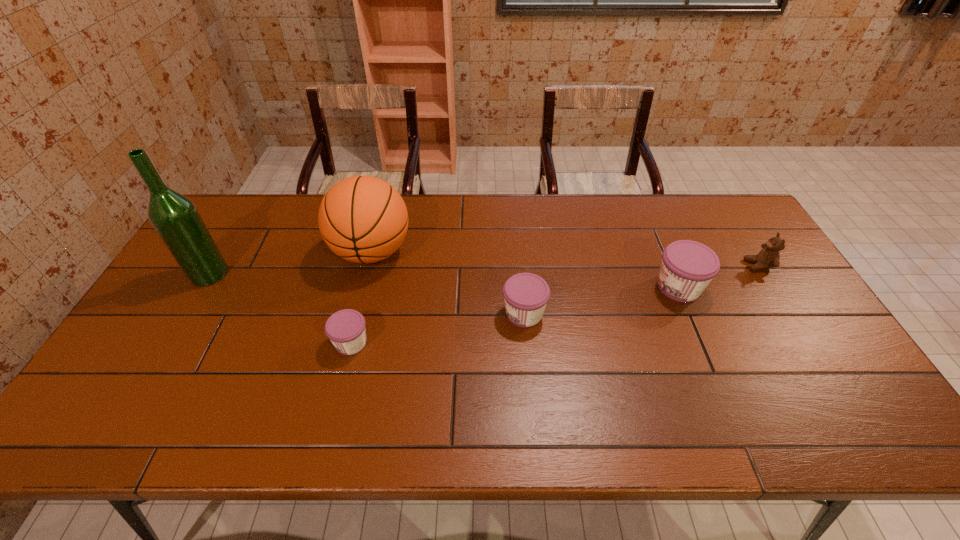
The width and height of the screenshot is (960, 540). I want to click on vacant space in between the second tallest object and the fifth object from left to right, so click(x=525, y=269).

This screenshot has width=960, height=540. In order to click on empty location between the leftmost jam and the teddy bear in this screenshot , I will do `click(555, 304)`.

Locate an element on the screen. The image size is (960, 540). vacant point located between the leftmost object and the rightmost object is located at coordinates (484, 269).

Where is `blank region between the teddy bear and the leftmost object`? The width and height of the screenshot is (960, 540). blank region between the teddy bear and the leftmost object is located at coordinates (484, 269).

Identify which object is located as the second nearest to the teddy bear. Please provide its 2D coordinates. Your answer should be formatted as a tuple, i.e. [(x, y)], where the tuple contains the x and y coordinates of a point satisfying the conditions above.

[(525, 294)]

Find the location of a particular element. The height and width of the screenshot is (540, 960). the closest object to the leftmost object is located at coordinates click(363, 219).

Locate which jam is the closest to the basketball. Please provide its 2D coordinates. Your answer should be formatted as a tuple, i.e. [(x, y)], where the tuple contains the x and y coordinates of a point satisfying the conditions above.

[(346, 330)]

The image size is (960, 540). What are the coordinates of `the closest jam to the leftmost object` in the screenshot? It's located at (346, 330).

Where is `vacant space that satisfies the following two spatial constraints: 1. at the face of the teddy bear; 2. on the front side of the tallest object`? The width and height of the screenshot is (960, 540). vacant space that satisfies the following two spatial constraints: 1. at the face of the teddy bear; 2. on the front side of the tallest object is located at coordinates (763, 273).

At what (x,y) coordinates should I click in order to perform the action: click on vacant position in the image that satisfies the following two spatial constraints: 1. on the back side of the tallest object; 2. on the left side of the second tallest object. Please return your answer as a coordinate pair (x, y). Looking at the image, I should click on (222, 252).